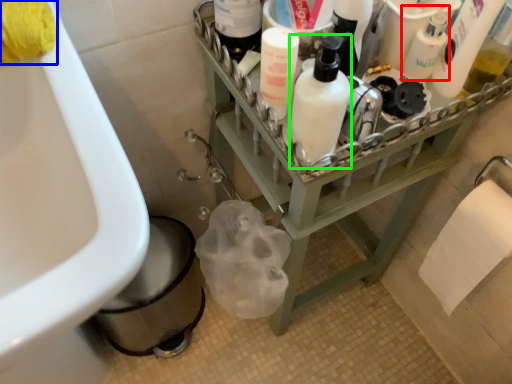
Question: Which object is positioned farthest from cleaning product (highlighted by a red box)? Select from toilet paper (highlighted by a blue box) and cleaning product (highlighted by a green box).

Choices:
 (A) toilet paper
 (B) cleaning product

Answer: (A)